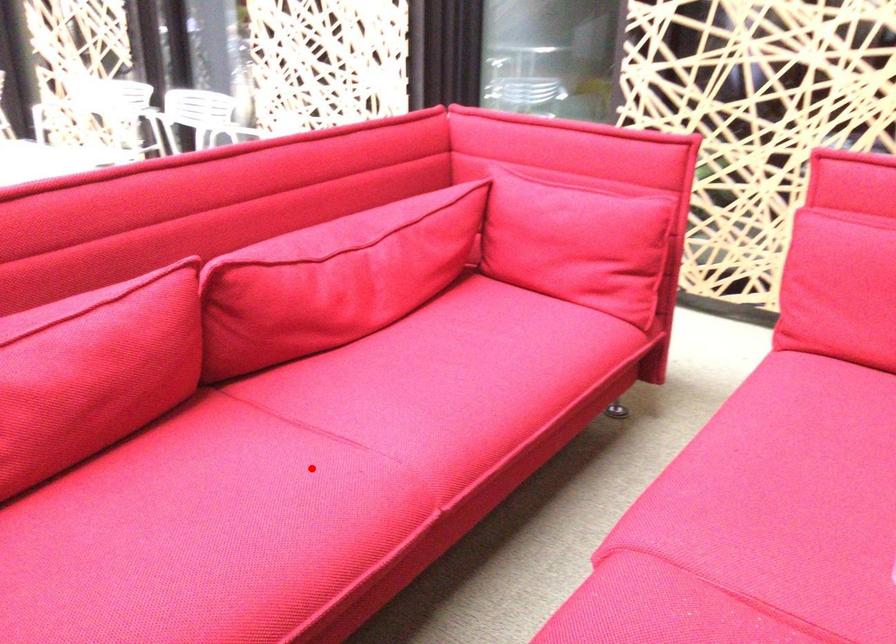
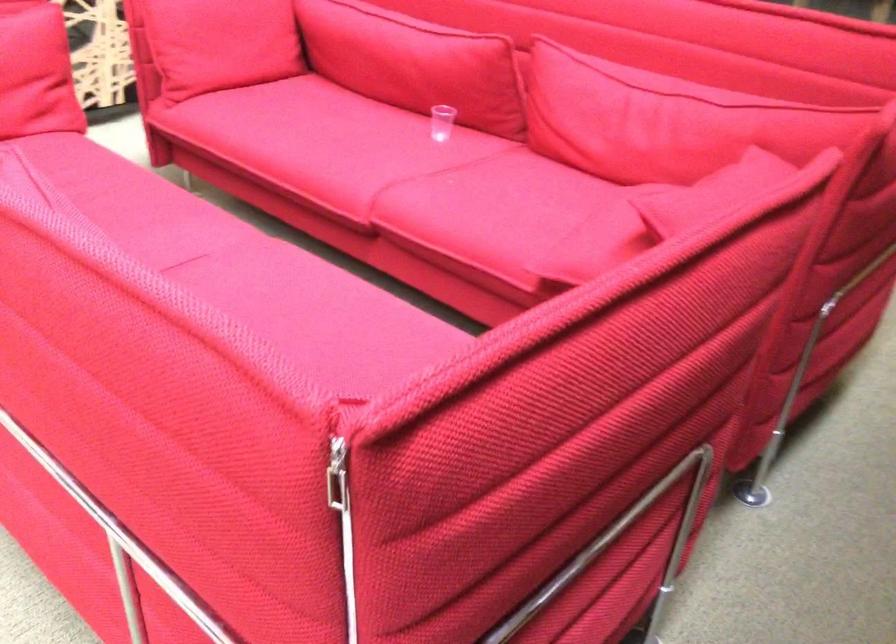
The point at the highlighted location is marked in the first image. Where is the corresponding point in the second image?

(244, 270)